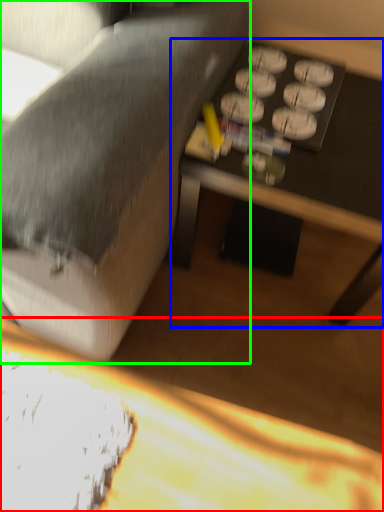
Question: Which is farther away from table (highlighted by a red box)? table (highlighted by a blue box) or studio couch (highlighted by a green box)?

Choices:
 (A) table
 (B) studio couch

Answer: (A)